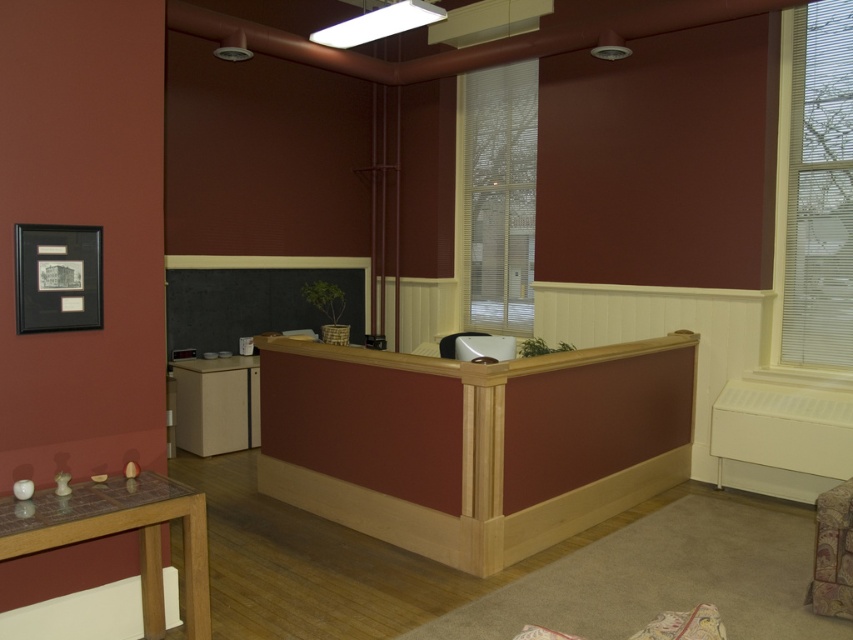
Is matte glass table at lower left to the right of floral fabric ottoman at lower right from the viewer's perspective?

Incorrect, matte glass table at lower left is not on the right side of floral fabric ottoman at lower right.

What do you see at coordinates (119, 532) in the screenshot? I see `matte glass table at lower left` at bounding box center [119, 532].

This screenshot has height=640, width=853. I want to click on matte glass table at lower left, so click(119, 532).

Which is above, white blinds at upper right or floral fabric ottoman at lower right?

white blinds at upper right is above.

Locate an element on the screen. Image resolution: width=853 pixels, height=640 pixels. white blinds at upper right is located at coordinates (819, 189).

Locate an element on the screen. The image size is (853, 640). white blinds at upper right is located at coordinates (819, 189).

From the picture: Which is above, white mesh window at center or matte glass table at lower left?

white mesh window at center

Can you confirm if white mesh window at center is positioned to the right of matte glass table at lower left?

Indeed, white mesh window at center is positioned on the right side of matte glass table at lower left.

Is point (469, 113) farther from camera compared to point (206, 625)?

Yes.

The width and height of the screenshot is (853, 640). Find the location of `white mesh window at center`. white mesh window at center is located at coordinates (497, 195).